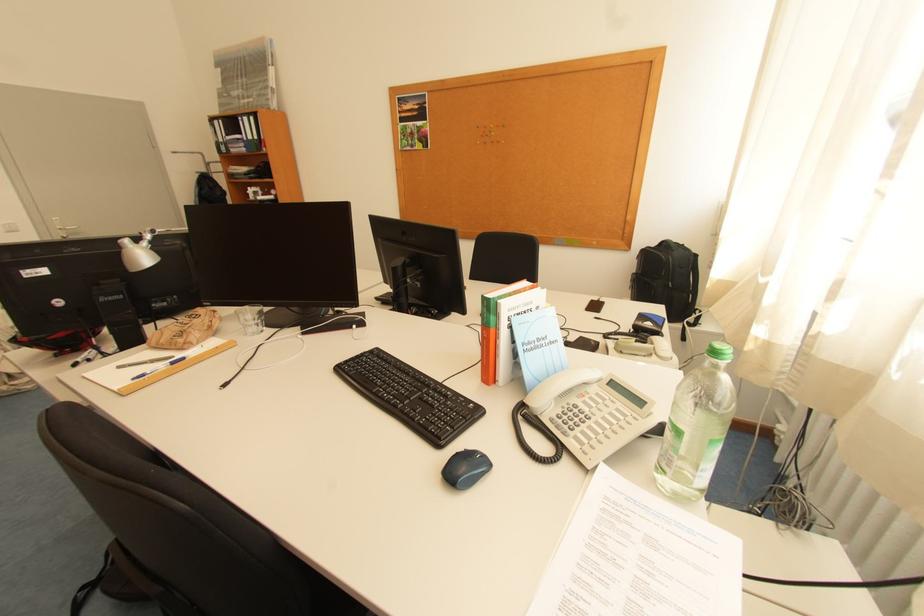
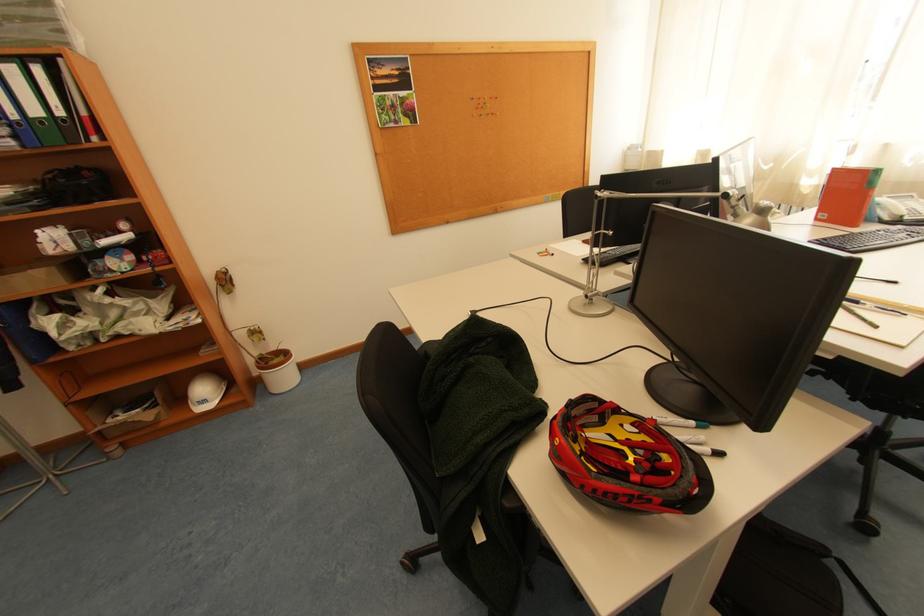
Locate, in the second image, the point that corresponds to pixel 253 148 in the first image.

(23, 139)